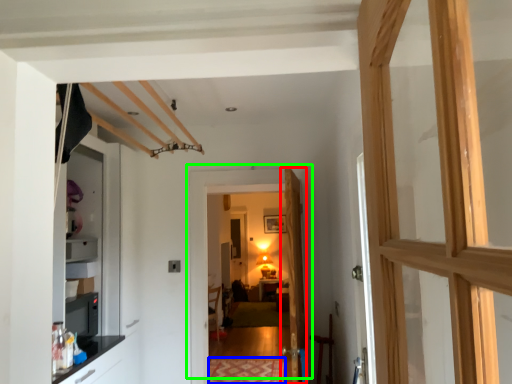
Question: Estimate the real-world distances between objects in this image. Which object is closer to door (highlighted by a red box), mat (highlighted by a blue box) or door (highlighted by a green box)?

Choices:
 (A) mat
 (B) door

Answer: (B)